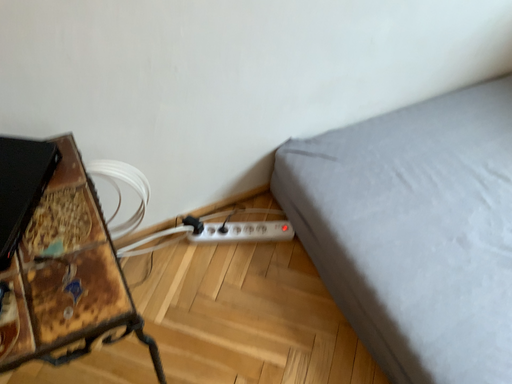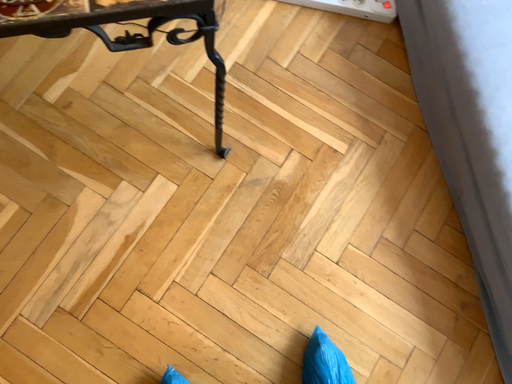
Question: How did the camera likely rotate when shooting the video?

Choices:
 (A) rotated upward
 (B) rotated downward

Answer: (B)